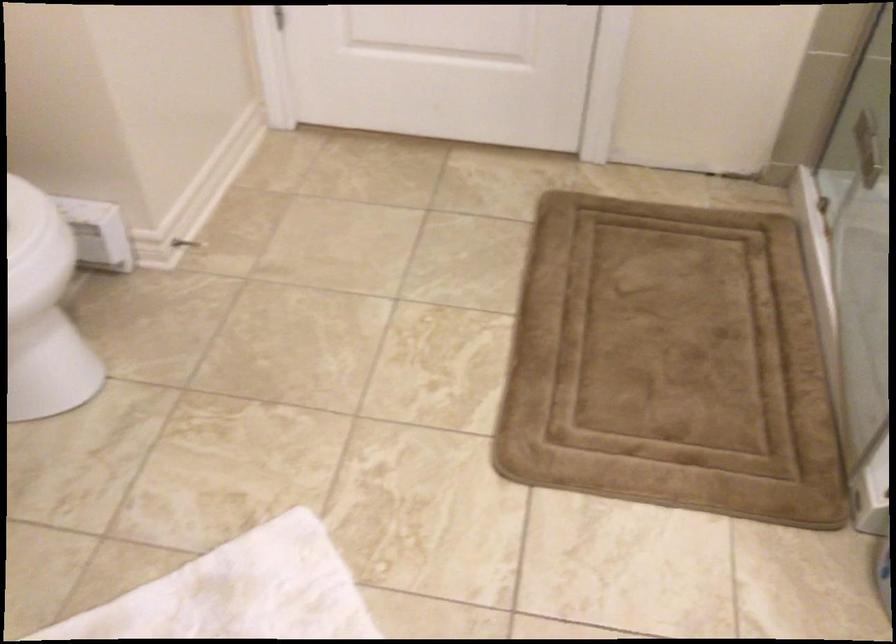
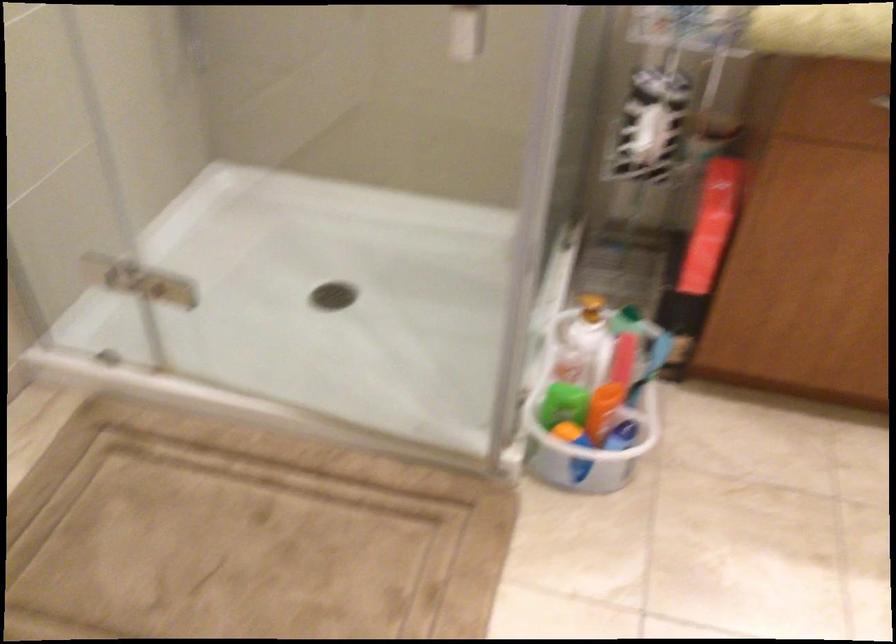
First-person continuous shooting, in which direction is the camera rotating?

The camera's rotation is toward right-down.